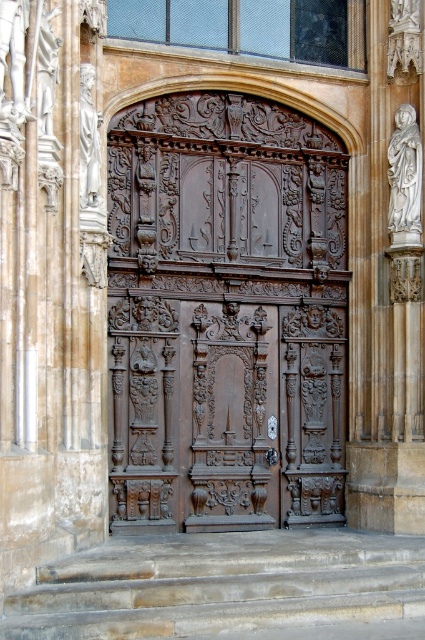
Question: Which of the following is the farthest from the observer?

Choices:
 (A) white marble statue at left
 (B) dark wood carved door at center

Answer: (B)

Question: Is dark wood carved door at center thinner than smooth stone stairs at lower center?

Choices:
 (A) no
 (B) yes

Answer: (B)

Question: Is dark wood carved door at center further to camera compared to smooth stone stairs at lower center?

Choices:
 (A) no
 (B) yes

Answer: (B)

Question: Can you confirm if dark wood carved door at center is wider than white marble statue at right?

Choices:
 (A) yes
 (B) no

Answer: (B)

Question: Which of the following is the closest to the observer?

Choices:
 (A) click(82, 136)
 (B) click(394, 228)
 (C) click(316, 228)
 (D) click(113, 550)

Answer: (D)

Question: Which object appears farthest from the camera in this image?

Choices:
 (A) white marble statue at right
 (B) smooth stone stairs at lower center

Answer: (A)